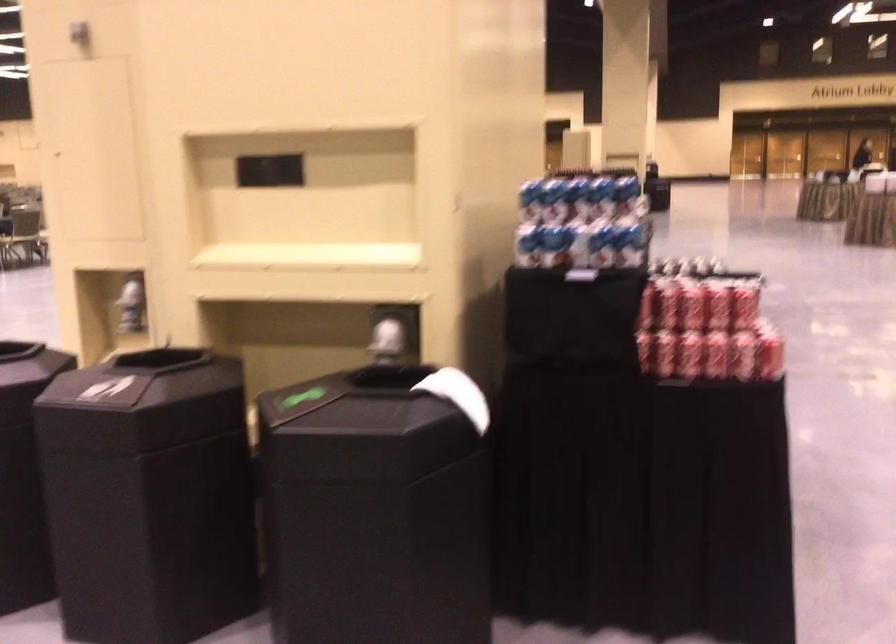
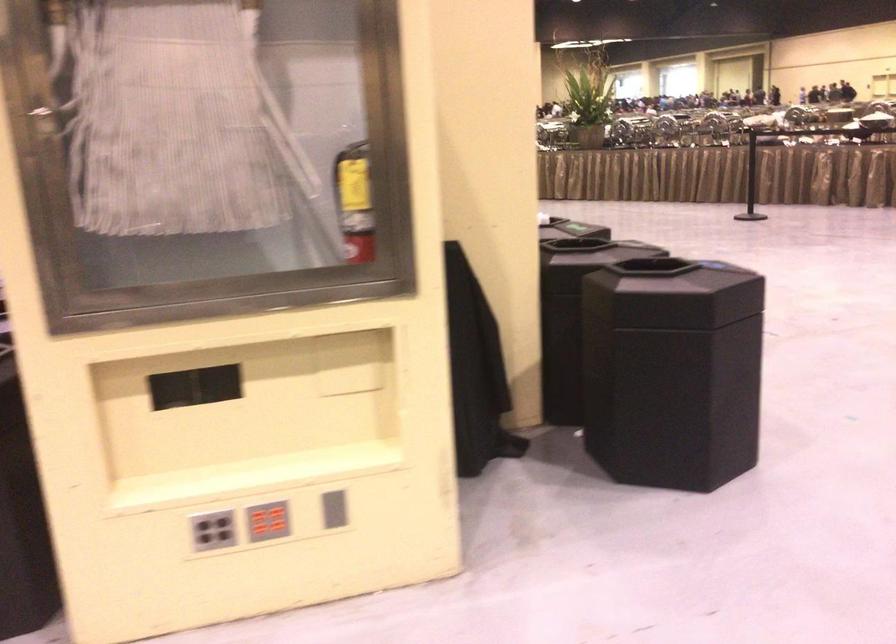
Question: I am providing you with two images of the same scene from different viewpoints. After the viewpoint changes to image2, which objects are now occluded?

Choices:
 (A) yellow bicycle lock
 (B) red soda can
 (C) grey button panel
 (D) grey vertical slot

Answer: (B)